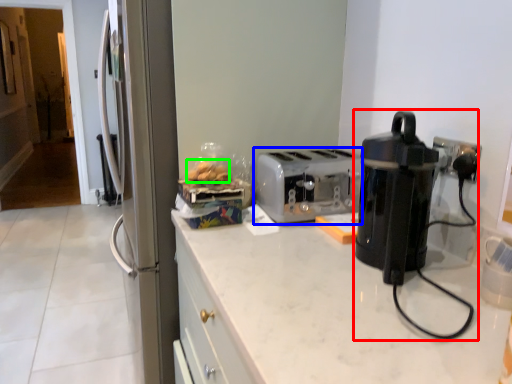
Question: Considering the real-world distances, which object is closest to home appliance (highlighted by a red box)? toaster (highlighted by a blue box) or food (highlighted by a green box).

Choices:
 (A) toaster
 (B) food

Answer: (A)